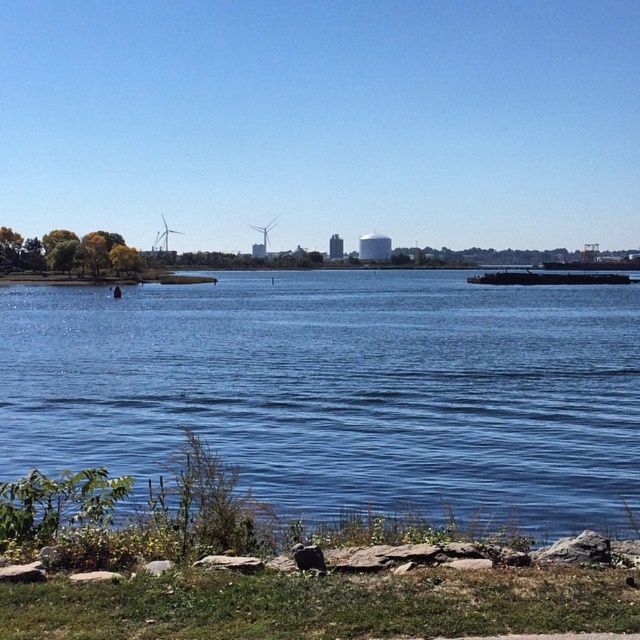
Does point (384, 300) lie behind point (273, 221)?

No.

Find the location of a particular element. blue liquid water at center is located at coordinates (340, 392).

Identify the location of blue liquid water at center. The height and width of the screenshot is (640, 640). (340, 392).

Does blue liquid water at center appear on the left side of white matte wind turbine at left?

Incorrect, blue liquid water at center is not on the left side of white matte wind turbine at left.

Does blue liquid water at center lie in front of white matte wind turbine at left?

Yes.

What are the coordinates of `blue liquid water at center` in the screenshot? It's located at (340, 392).

At what (x,y) coordinates should I click in order to perform the action: click on blue liquid water at center. Please return your answer as a coordinate pair (x, y). This screenshot has width=640, height=640. Looking at the image, I should click on (340, 392).

Does white matte wind turbine at left appear on the left side of white matte wind turbine at center?

Correct, you'll find white matte wind turbine at left to the left of white matte wind turbine at center.

Is white matte wind turbine at left wider than white matte wind turbine at center?

Correct, the width of white matte wind turbine at left exceeds that of white matte wind turbine at center.

Find the location of a particular element. This screenshot has height=640, width=640. white matte wind turbine at left is located at coordinates (163, 236).

The width and height of the screenshot is (640, 640). Identify the location of white matte wind turbine at left. (163, 236).